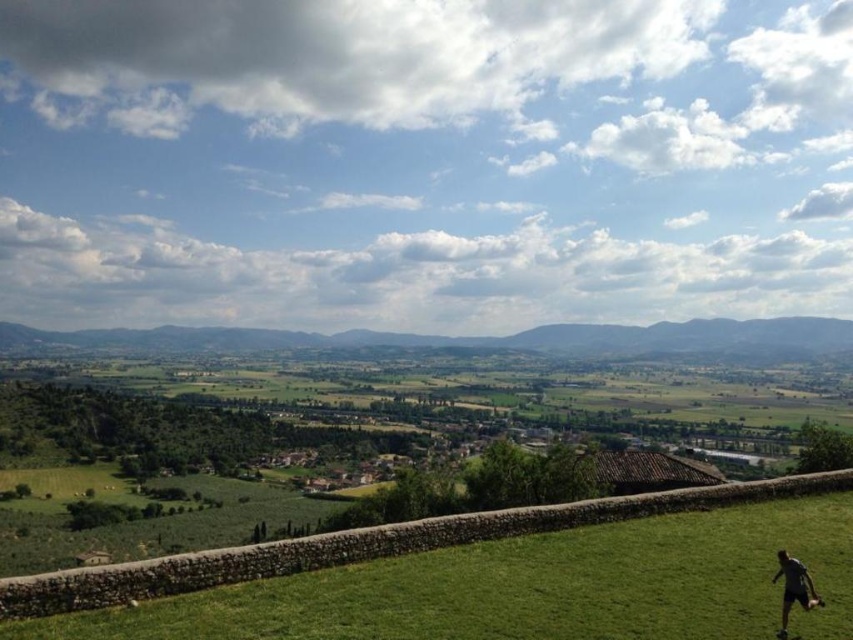
You are standing at the bottom of the green grassy hillside at center and want to reach the dark gray shirt at lower right. In which direction should you walk to get there?

You should walk to the right since the dark gray shirt at lower right is positioned on the right side of the green grassy hillside at center.

You are standing at the base of the green grassy hillside at center and want to walk to the green grassy field at lower right. Which direction should you go?

The green grassy field at lower right is located above the green grassy hillside at center, so you should walk upwards to reach it.

You are standing at the stone wall in the foreground of the rural landscape. Looking towards the lower right, you notice a point marked at coordinates (531, 588). What type of terrain or feature does this point indicate?

The point at (531, 588) marks a green grassy field at lower right.